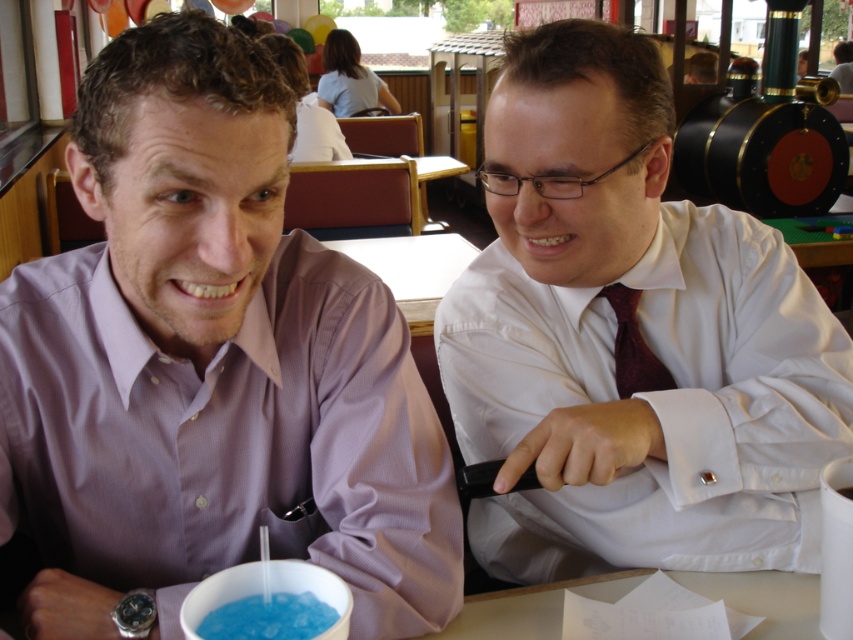
Question: Can you confirm if white paper at center is positioned to the right of maroon textured tie at right?

Choices:
 (A) no
 (B) yes

Answer: (A)

Question: Is blue translucent liquid at lower center closer to the viewer compared to maroon textured tie at right?

Choices:
 (A) yes
 (B) no

Answer: (A)

Question: Which object is farther from the camera taking this photo?

Choices:
 (A) white paper at center
 (B) matte purple shirt at left

Answer: (A)

Question: Which is farther from the matte purple shirt at left?

Choices:
 (A) white paper at center
 (B) maroon textured tie at right
 (C) blue translucent liquid at lower center

Answer: (B)

Question: Is matte purple shirt at left in front of blue translucent liquid at lower center?

Choices:
 (A) yes
 (B) no

Answer: (B)

Question: Which of the following is the closest to the observer?

Choices:
 (A) (619, 348)
 (B) (486, 596)

Answer: (B)